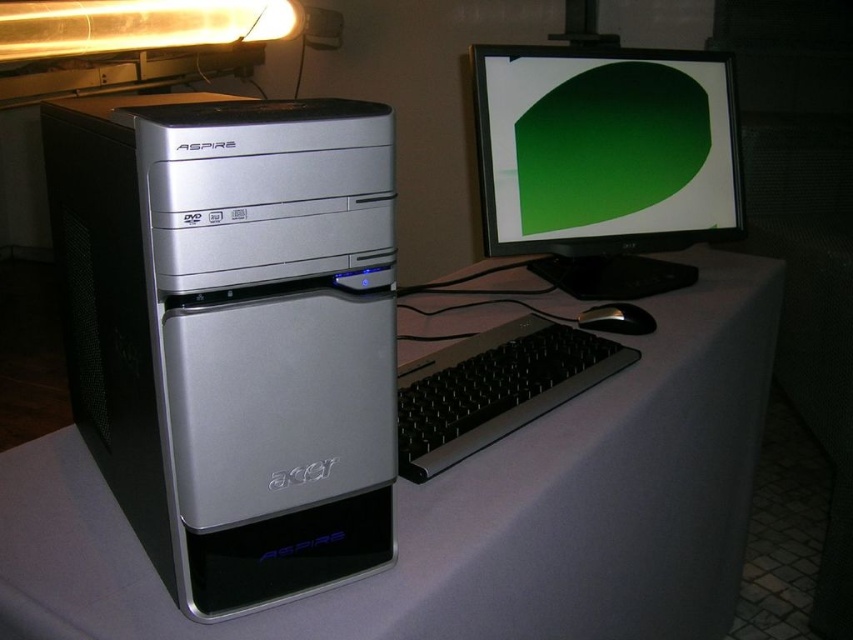
You are a technician who needs to access the DVD drive slot on the silver metallic computer tower at left. Considering your height and the tower being 15.49 inches away from you, can you comfortably reach the DVD drive slot without moving the tower?

The silver metallic computer tower at left is 15.49 inches away from the viewer. Since the distance is within a typical comfortable reaching range for most adults, the technician can comfortably access the DVD drive slot without moving the tower.

You are setting up a new computer and need to place the monitor so that it is exactly 20 inches away from the keyboard. Given the current setup where the point representing the monitor is at coordinate point (294, 568) and the keyboard is at another point, can you determine if the monitor is positioned correctly?

The distance between the monitor at point (294, 568) and the keyboard is 20.80 inches, which is slightly more than the required 20 inches. Therefore, the monitor is positioned a bit too far from the keyboard.

You are organizing your desk and want to place a new monitor between the silver metallic computer tower at left and the white matte computer desk at center. Can you do this without moving either object?

The silver metallic computer tower at left is in front of the white matte computer desk at center, so there is no space between them to place the new monitor without moving either object.